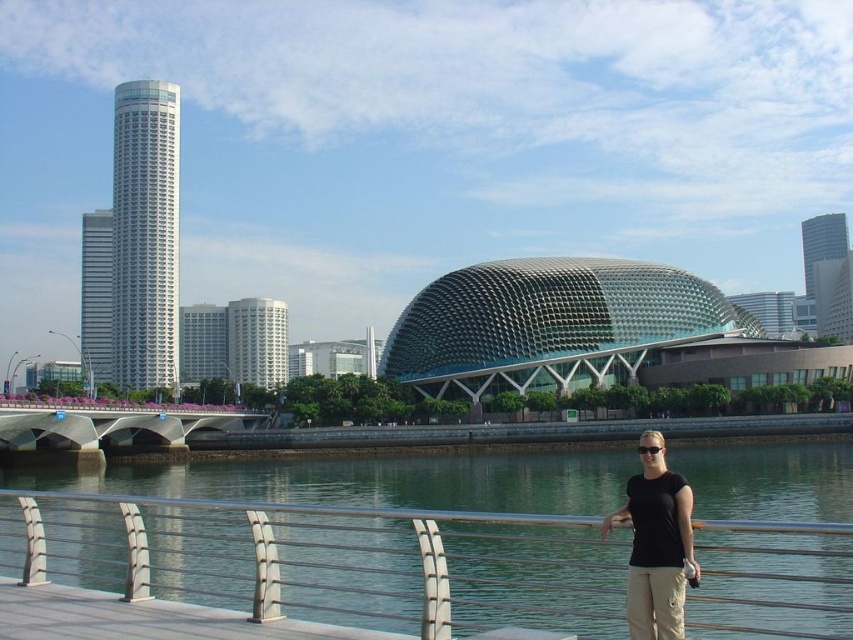
You are a photographer standing on the pedestrian walkway and want to take a photo of both the point at coordinates [631,538] and the point at coordinates [83,432]. Based on their positions, which point will appear larger in your camera view?

The point at coordinates [631,538] will appear larger in the camera view because it is closer to the camera than the point at coordinates [83,432].

From the picture: You are standing on the pedestrian walkway and want to take a photo of both the woman and the architectural landmark. The woman is at point (146, 531) and the landmark is at point (660, 481). Which point is closer to you so you can focus your camera properly?

Point (146, 531) is closer to you than point (660, 481), so you should focus on that point first to capture both subjects clearly.